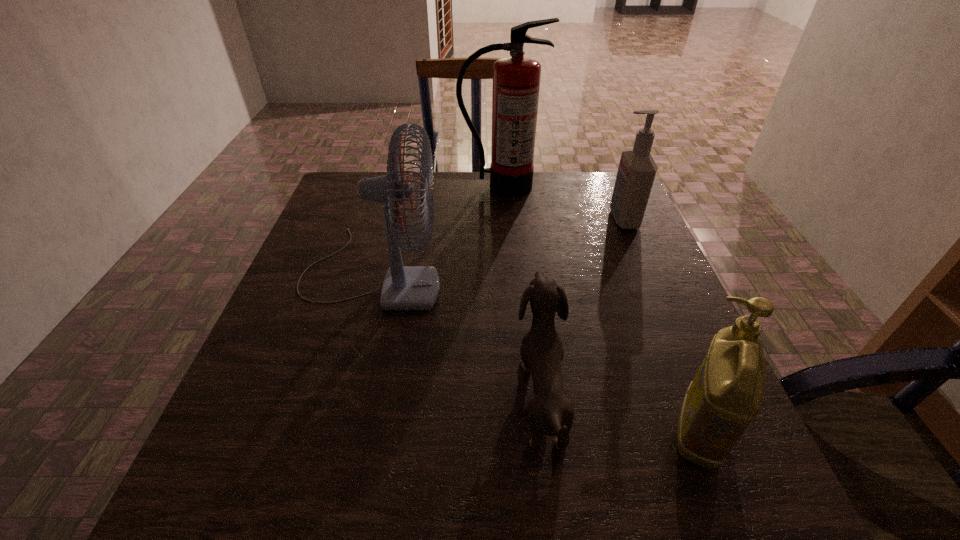
Image resolution: width=960 pixels, height=540 pixels. I want to click on fire extinguisher, so click(516, 79).

Find the location of `the tallest object`. the tallest object is located at coordinates (516, 79).

The height and width of the screenshot is (540, 960). Find the location of `the second tallest object`. the second tallest object is located at coordinates (405, 288).

Identify the location of fan. The width and height of the screenshot is (960, 540). (405, 288).

Find the location of `cleansing agent`. cleansing agent is located at coordinates (637, 169).

Identify the location of detergent. (726, 394).

What are the coordinates of `puppy` in the screenshot? It's located at (551, 413).

Where is `free point located on the front-facing side of the farthest object`? Image resolution: width=960 pixels, height=540 pixels. free point located on the front-facing side of the farthest object is located at coordinates (503, 226).

Locate an element on the screen. free space located 0.070m on the front-facing side of the fourth shortest object is located at coordinates (471, 273).

Where is `free space located on the front label of the cleansing agent`? free space located on the front label of the cleansing agent is located at coordinates (555, 219).